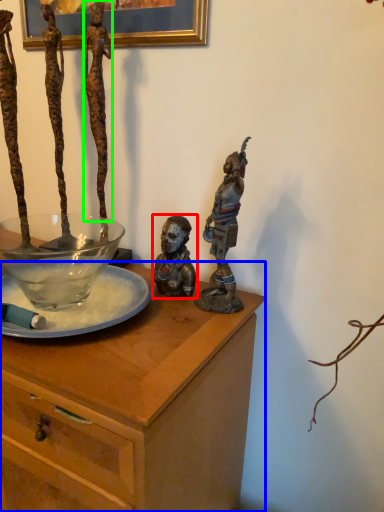
Question: Estimate the real-world distances between objects in this image. Which object is farther from person (highlighted by a red box), desk (highlighted by a blue box) or person (highlighted by a green box)?

Choices:
 (A) desk
 (B) person

Answer: (B)